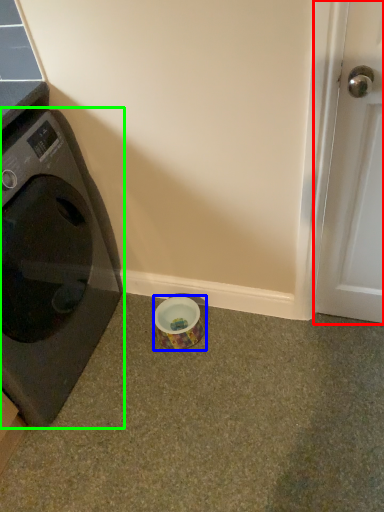
Question: Which object is the farthest from door (highlighted by a red box)? Choose among these: tape (highlighted by a blue box) or washing machine (highlighted by a green box).

Choices:
 (A) tape
 (B) washing machine

Answer: (B)